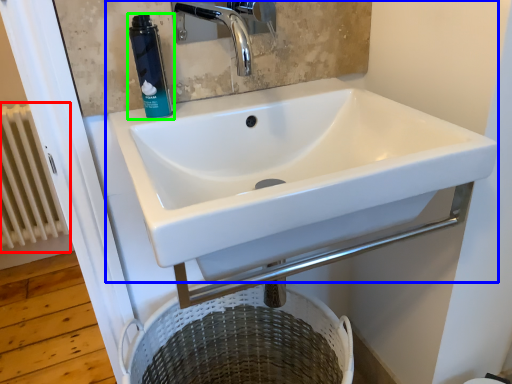
Question: Which object is positioned farthest from radiator (highlighted by a red box)? Select from sink (highlighted by a blue box) and mouthwash (highlighted by a green box).

Choices:
 (A) sink
 (B) mouthwash

Answer: (B)